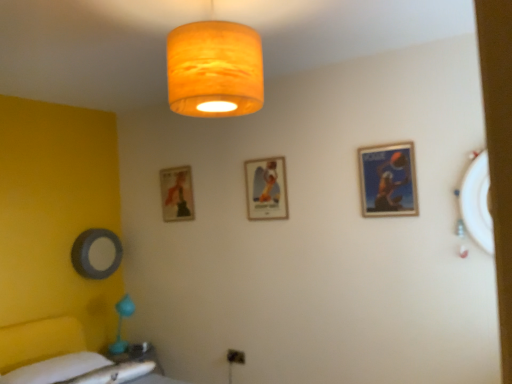
Question: Can you confirm if matte blue poster at upper right, the first picture frame in the right-to-left sequence, is wider than white fabric bedsheet at lower left?

Choices:
 (A) no
 (B) yes

Answer: (A)

Question: Can you confirm if matte blue poster at upper right, the first picture frame in the right-to-left sequence, is taller than white fabric bedsheet at lower left?

Choices:
 (A) no
 (B) yes

Answer: (B)

Question: Does matte blue poster at upper right, the first picture frame in the right-to-left sequence, appear on the left side of white fabric bedsheet at lower left?

Choices:
 (A) no
 (B) yes

Answer: (A)

Question: Is matte blue poster at upper right, the first picture frame in the right-to-left sequence, to the right of white fabric bedsheet at lower left from the viewer's perspective?

Choices:
 (A) yes
 (B) no

Answer: (A)

Question: Does matte blue poster at upper right, the first picture frame in the right-to-left sequence, come in front of white fabric bedsheet at lower left?

Choices:
 (A) no
 (B) yes

Answer: (A)

Question: Considering the relative positions of matte gold picture frame at center, acting as the 2th picture frame starting from the front, and matte orange fabric lampshade at upper center in the image provided, is matte gold picture frame at center, acting as the 2th picture frame starting from the front, to the left or to the right of matte orange fabric lampshade at upper center?

Choices:
 (A) right
 (B) left

Answer: (A)

Question: Is matte gold picture frame at center, marked as the 2th picture frame in a right-to-left arrangement, taller or shorter than matte orange fabric lampshade at upper center?

Choices:
 (A) tall
 (B) short

Answer: (B)

Question: Considering the positions of matte gold picture frame at center, acting as the 2th picture frame starting from the front, and matte orange fabric lampshade at upper center in the image, is matte gold picture frame at center, acting as the 2th picture frame starting from the front, wider or thinner than matte orange fabric lampshade at upper center?

Choices:
 (A) thin
 (B) wide

Answer: (A)

Question: From the image's perspective, is matte gold picture frame at center, the 2th picture frame in the back-to-front sequence, positioned above or below matte orange fabric lampshade at upper center?

Choices:
 (A) below
 (B) above

Answer: (A)

Question: From a real-world perspective, is matte gold picture frame at center, placed as the second picture frame when sorted from left to right, above or below matte white table at lower left?

Choices:
 (A) below
 (B) above

Answer: (B)

Question: Is matte gold picture frame at center, placed as the second picture frame when sorted from left to right, wider or thinner than matte white table at lower left?

Choices:
 (A) thin
 (B) wide

Answer: (A)

Question: Relative to matte white table at lower left, is matte gold picture frame at center, marked as the 2th picture frame in a right-to-left arrangement, in front or behind?

Choices:
 (A) front
 (B) behind

Answer: (A)

Question: Choose the correct answer: Is matte gold picture frame at center, the 2th picture frame in the back-to-front sequence, inside matte white table at lower left or outside it?

Choices:
 (A) outside
 (B) inside

Answer: (A)

Question: Is matte gold picture frame at center, acting as the 2th picture frame starting from the front, spatially inside matte blue poster at upper right, the first picture frame in the front-to-back sequence, or outside of it?

Choices:
 (A) outside
 (B) inside

Answer: (A)

Question: In terms of height, does matte gold picture frame at center, placed as the second picture frame when sorted from left to right, look taller or shorter compared to matte blue poster at upper right, the first picture frame in the right-to-left sequence?

Choices:
 (A) short
 (B) tall

Answer: (B)